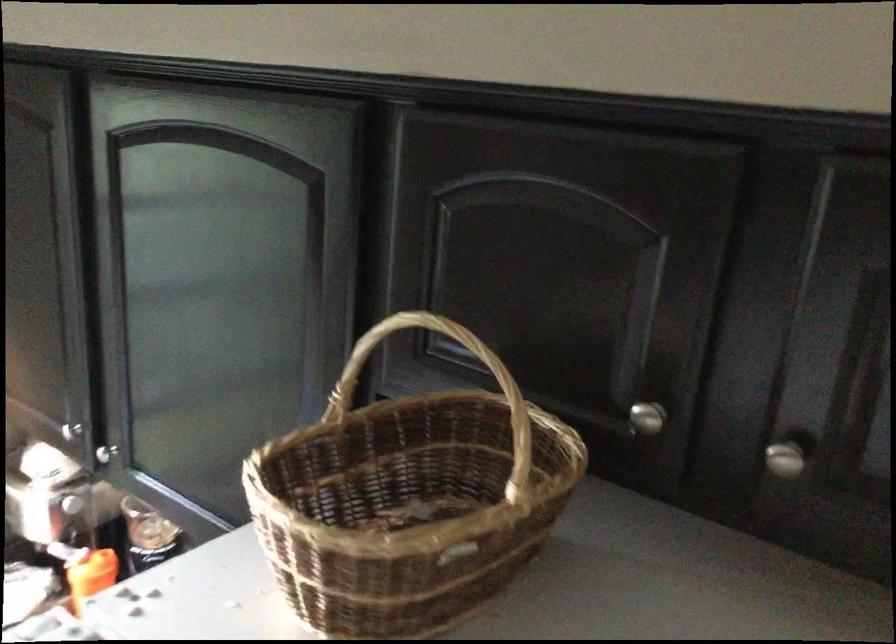
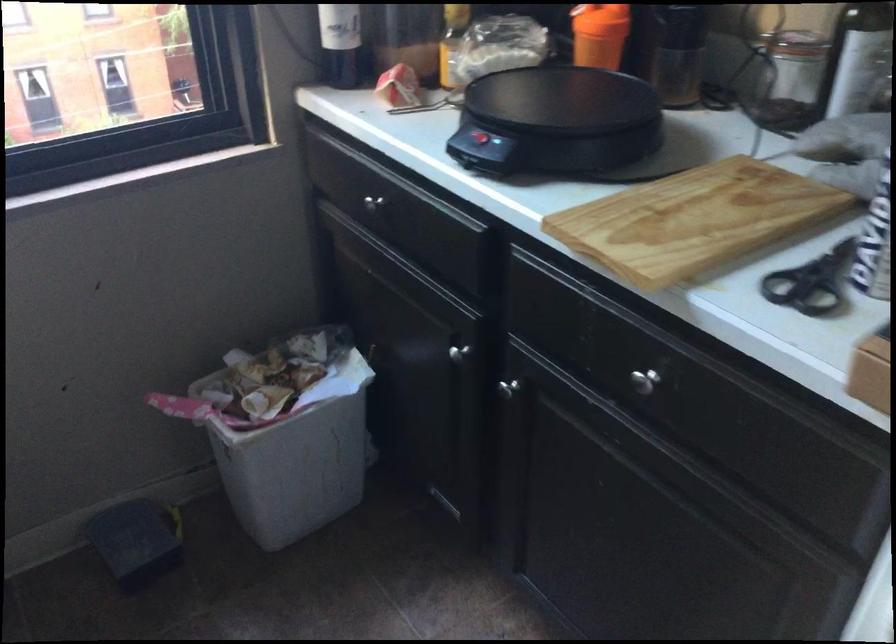
Find the pixel in the second image that matches pixel 82 558 in the first image.

(599, 35)